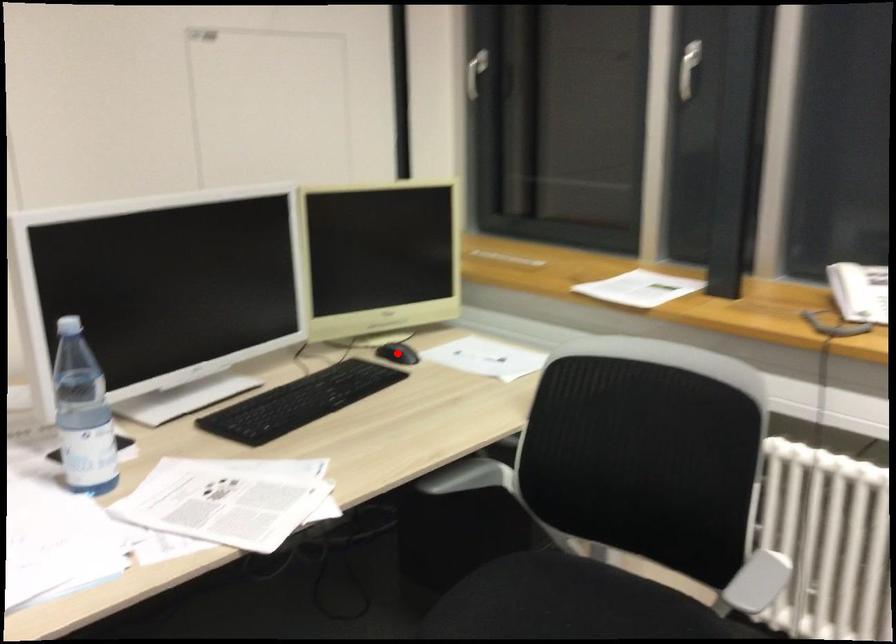
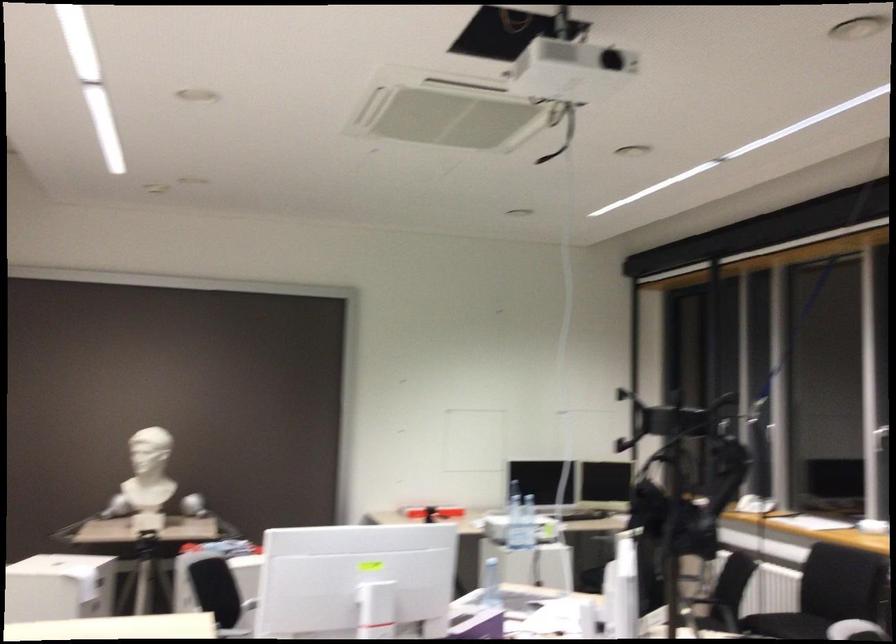
Question: I am providing you with two images of the same scene from different viewpoints. A red point is marked on the first image. At the location where the point appears in image 1, is it still visible in image 2?

Choices:
 (A) Yes
 (B) No

Answer: (B)